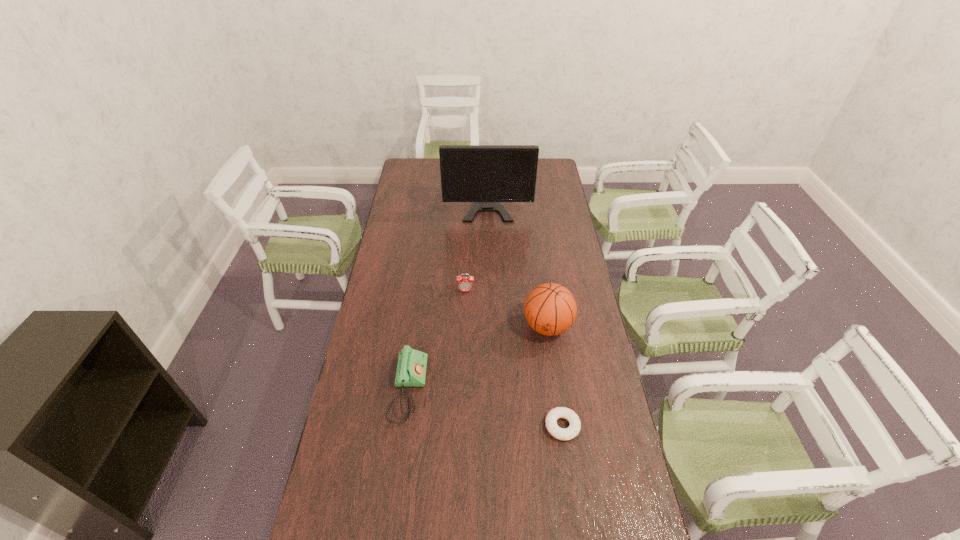
This screenshot has height=540, width=960. Identify the location of computer monitor. coord(485,174).

At what (x,y) coordinates should I click in order to perform the action: click on the farthest object. Please return your answer as a coordinate pair (x, y). This screenshot has width=960, height=540. Looking at the image, I should click on click(x=485, y=174).

You are a GUI agent. You are given a task and a screenshot of the screen. Output one action in this format:
    pyautogui.click(x=<x>, y=<y>)
    Task: Click on the basketball
    
    Given the screenshot: What is the action you would take?
    coord(550,309)

The width and height of the screenshot is (960, 540). Identify the location of the fourth shortest object. (550, 309).

Find the location of a particular element. Image resolution: width=960 pixels, height=540 pixels. alarm clock is located at coordinates [465, 284].

You are a GUI agent. You are given a task and a screenshot of the screen. Output one action in this format:
    pyautogui.click(x=<x>, y=<y>)
    Task: Click on the second farthest object
    
    Given the screenshot: What is the action you would take?
    pyautogui.click(x=465, y=284)

Identify the location of telephone. The image size is (960, 540). (411, 369).

Where is `the fourth tallest object`? This screenshot has width=960, height=540. the fourth tallest object is located at coordinates (411, 369).

The image size is (960, 540). Identify the location of doughnut. (572, 431).

The height and width of the screenshot is (540, 960). Identify the location of vacant space situated on the screen side of the tallest object. (489, 252).